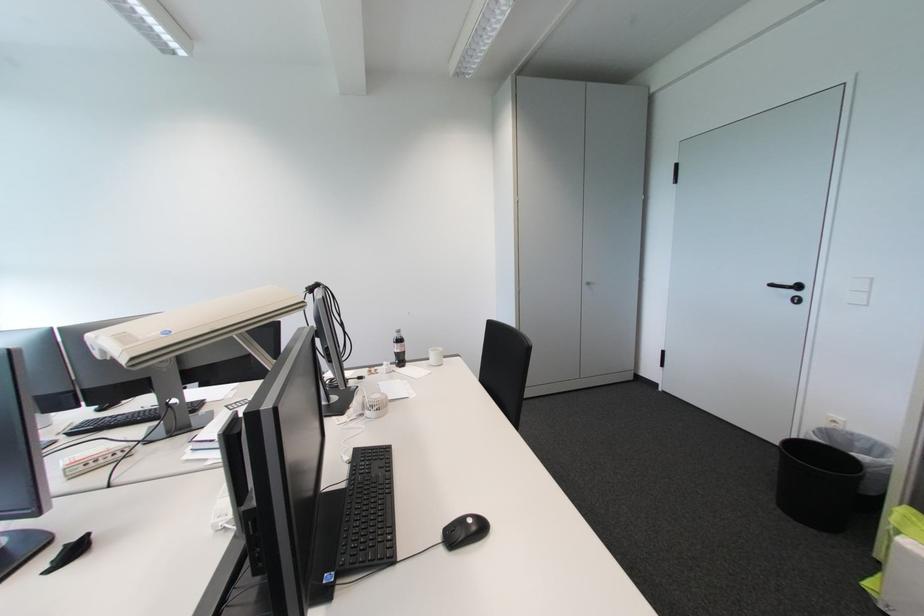
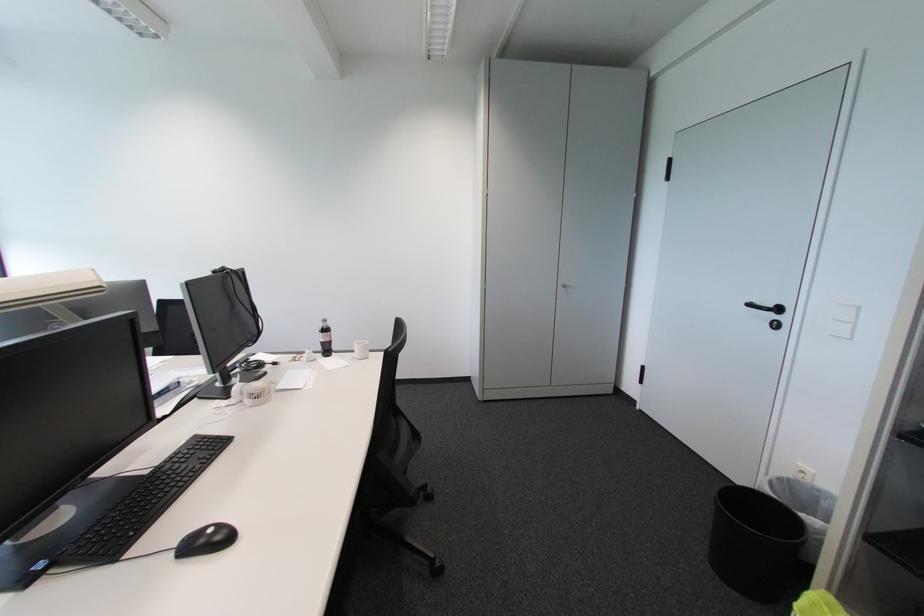
In the second image, find the point that corresponds to point 434,361 in the first image.

(359, 353)